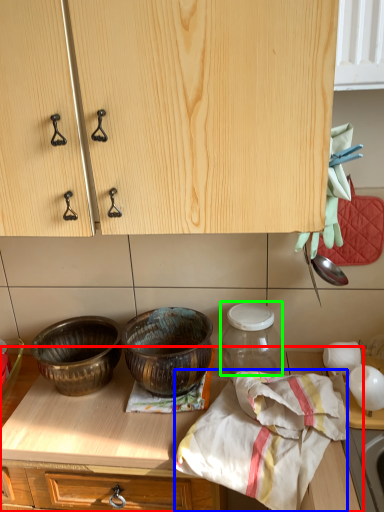
Question: Which object is positioned farthest from countertop (highlighted by a red box)? Select from blanket (highlighted by a blue box) and glass jar (highlighted by a green box).

Choices:
 (A) blanket
 (B) glass jar

Answer: (B)